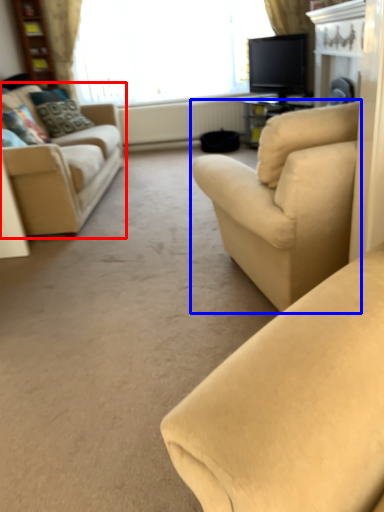
Question: Which point is further to the camera, studio couch (highlighted by a red box) or studio couch (highlighted by a blue box)?

Choices:
 (A) studio couch
 (B) studio couch

Answer: (A)